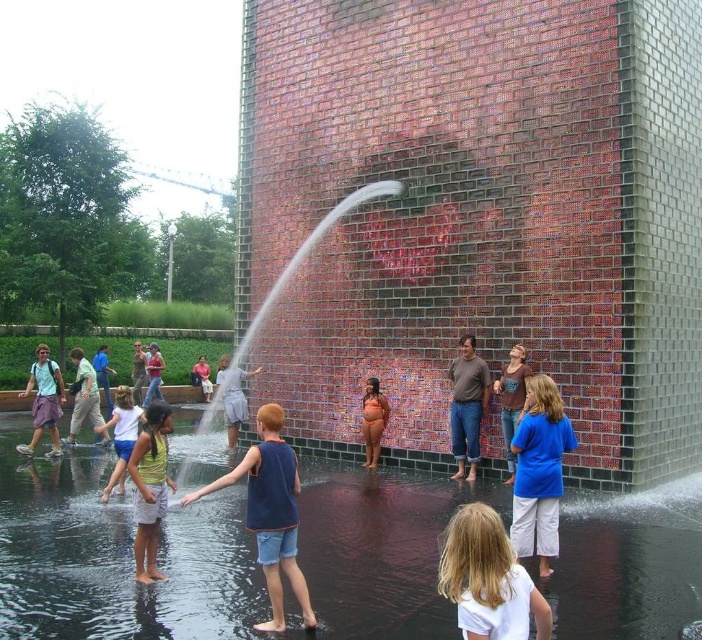
Question: Is brown cotton shirt at center above matte white shirt at center?

Choices:
 (A) no
 (B) yes

Answer: (B)

Question: Which of these objects is positioned closest to the clear water at center?

Choices:
 (A) blue denim shorts at center
 (B) matte white shirt at center
 (C) brown leather jacket at center

Answer: (A)

Question: Which point is closer to the camera taking this photo?

Choices:
 (A) (192, 380)
 (B) (147, 531)
 (C) (95, 385)
 (D) (32, 412)

Answer: (B)

Question: Can you confirm if light yellow shirt at center is positioned to the left of blue denim shorts at lower left?

Choices:
 (A) yes
 (B) no

Answer: (B)

Question: Can you confirm if matte white shirt at center is thinner than matte orange swimsuit at center?

Choices:
 (A) no
 (B) yes

Answer: (A)

Question: Which point is closer to the camera?

Choices:
 (A) (201, 365)
 (B) (256, 371)
 (C) (107, 492)
 (D) (105, 392)

Answer: (C)